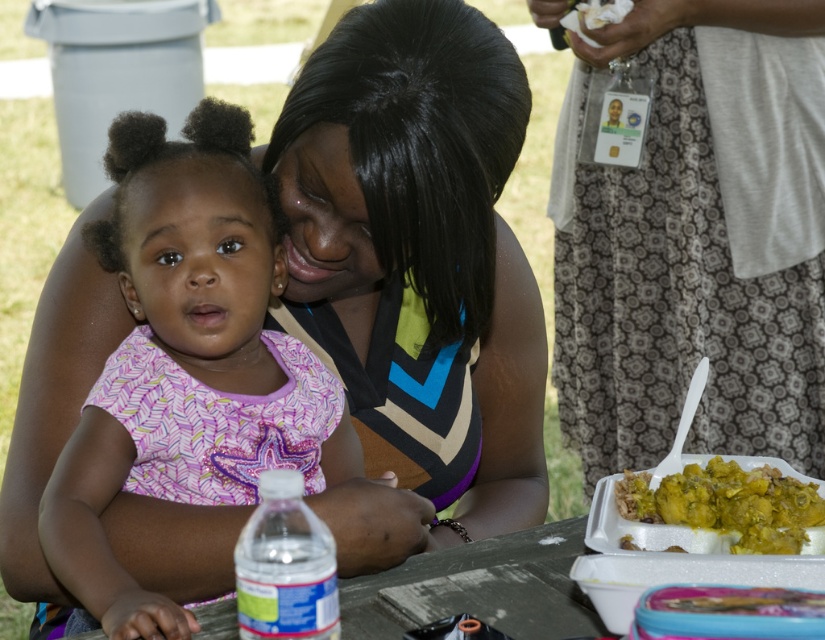
Question: Which object appears closest to the camera in this image?

Choices:
 (A) yellow-green sauce-covered rice at lower right
 (B) pink fabric dress at center

Answer: (B)

Question: Is the position of pink fabric dress at center less distant than that of yellow-green sauce-covered rice at lower right?

Choices:
 (A) yes
 (B) no

Answer: (A)

Question: From the image, what is the correct spatial relationship of pink fabric dress at center in relation to yellow-green sauce-covered rice at lower right?

Choices:
 (A) below
 (B) above

Answer: (B)

Question: Is pink fabric dress at center wider than yellow-green sauce-covered rice at lower right?

Choices:
 (A) yes
 (B) no

Answer: (A)